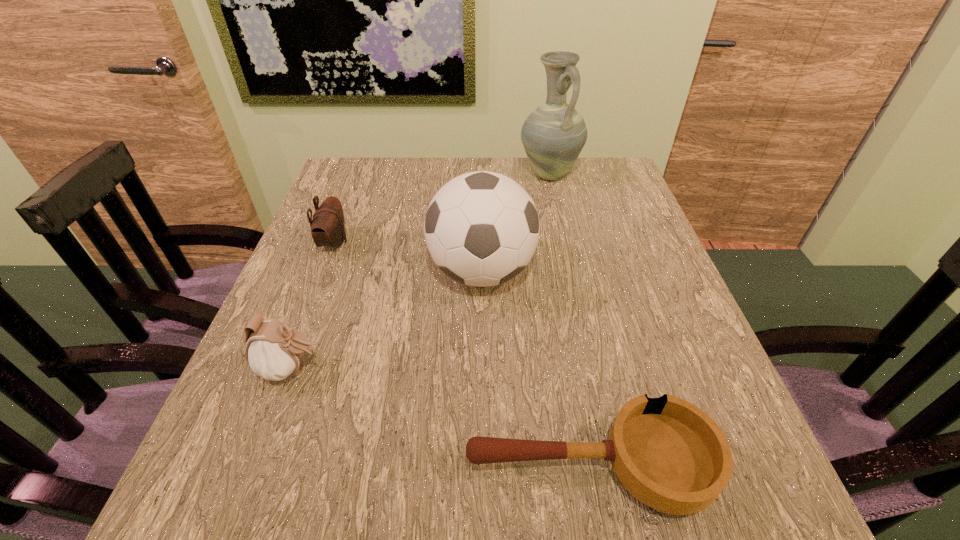
Where is `free space at the near edge of the desktop`? The height and width of the screenshot is (540, 960). free space at the near edge of the desktop is located at coordinates (468, 523).

I want to click on free location at the left edge of the desktop, so click(258, 385).

The width and height of the screenshot is (960, 540). Find the location of `free space at the right edge`. free space at the right edge is located at coordinates (607, 272).

In the image, there is a desktop. Identify the location of blank space at the far left corner. This screenshot has height=540, width=960. (338, 186).

Locate an element on the screen. The width and height of the screenshot is (960, 540). free spot at the far right corner of the desktop is located at coordinates (573, 180).

At what (x,y) coordinates should I click in order to perform the action: click on vacant space at the near right corner of the desktop. Please return your answer as a coordinate pair (x, y). Looking at the image, I should click on (677, 535).

You are a GUI agent. You are given a task and a screenshot of the screen. Output one action in this format:
    pyautogui.click(x=<x>, y=<y>)
    Task: Click on the empty space that is in between the shortest object and the soccer ball
    This screenshot has width=960, height=540.
    Given the screenshot: What is the action you would take?
    pyautogui.click(x=535, y=369)

This screenshot has height=540, width=960. What are the coordinates of `free area in between the saucepan and the farther pouch` in the screenshot? It's located at (462, 355).

Find the location of a particular element. This screenshot has width=960, height=540. vacant space that is in between the soccer ball and the nearer pouch is located at coordinates (386, 320).

Identify the location of vacant space that is in between the shortest object and the pitcher. (568, 320).